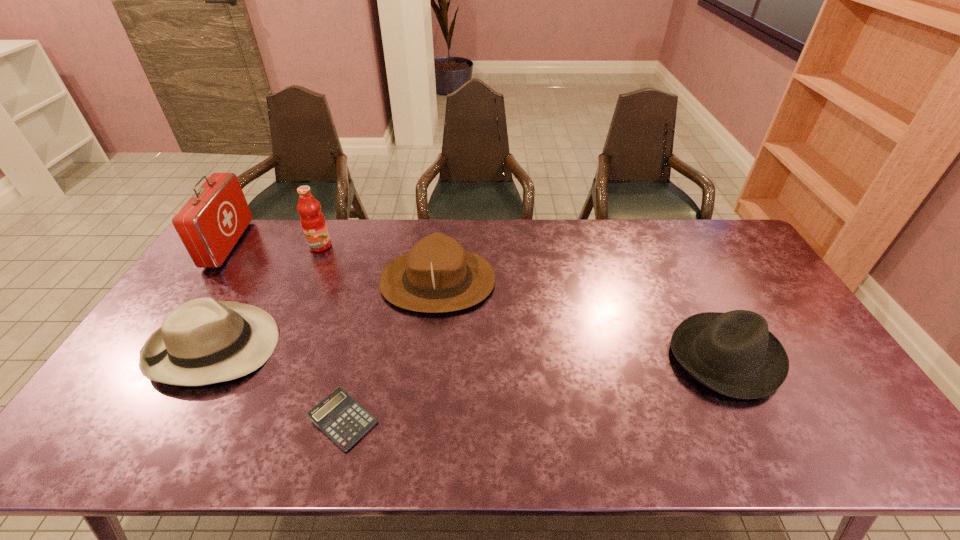
You are a GUI agent. You are given a task and a screenshot of the screen. Output one action in this format:
    pyautogui.click(x=<x>, y=<y>)
    Task: Click on the object situated at the far left corner
    The height and width of the screenshot is (540, 960).
    Given the screenshot: What is the action you would take?
    pyautogui.click(x=211, y=222)

Identify the location of free location at the far edge. (402, 220).

What are the coordinates of `free space at the near edge` in the screenshot? It's located at coord(684,460).

Identify the location of blank space at the right edge of the desktop. (745, 301).

Where is `vacant space at the near left corner of the desktop`? The image size is (960, 540). vacant space at the near left corner of the desktop is located at coordinates [102, 450].

The image size is (960, 540). Find the location of `vacant region at the far right corner of the desktop`. vacant region at the far right corner of the desktop is located at coordinates (729, 231).

I want to click on empty space that is in between the rightmost fedora and the second fedora from right to left, so click(582, 319).

Where is `unoccupied position between the leftmost fedora and the rightmost fedora`? The height and width of the screenshot is (540, 960). unoccupied position between the leftmost fedora and the rightmost fedora is located at coordinates (469, 352).

Where is `vacant area that lies between the calculator and the first-aid kit`? The height and width of the screenshot is (540, 960). vacant area that lies between the calculator and the first-aid kit is located at coordinates (286, 332).

At what (x,y) coordinates should I click in order to perform the action: click on free space between the fruit juice and the rightmost fedora. Please return your answer as a coordinate pair (x, y). Looking at the image, I should click on (523, 301).